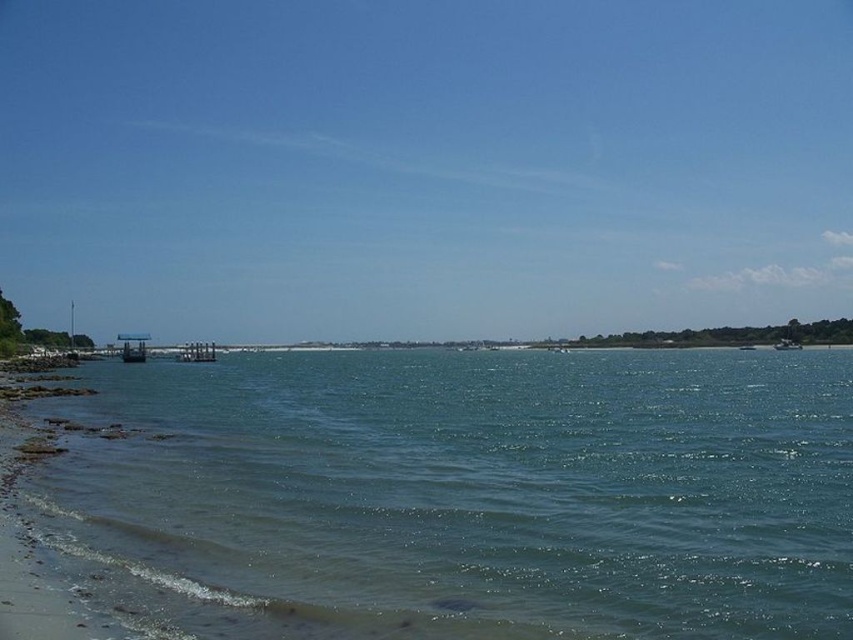
Question: Which object appears farthest from the camera in this image?

Choices:
 (A) metallic gray dock at center
 (B) clear blue water at lower left
 (C) metallic silver boat at right

Answer: (C)

Question: Can you confirm if metallic gray dock at center is positioned to the right of metallic silver boat at right?

Choices:
 (A) yes
 (B) no

Answer: (B)

Question: Is metallic gray dock at center to the left of metallic silver boat at right from the viewer's perspective?

Choices:
 (A) yes
 (B) no

Answer: (A)

Question: Which point is closer to the camera?

Choices:
 (A) metallic gray dock at center
 (B) clear blue water at lower left
 (C) metallic silver boat at right

Answer: (B)

Question: Where is metallic gray dock at center located in relation to metallic silver boat at right in the image?

Choices:
 (A) below
 (B) above

Answer: (A)

Question: Which of the following is the closest to the observer?

Choices:
 (A) clear blue water at lower left
 (B) metallic gray dock at center

Answer: (A)